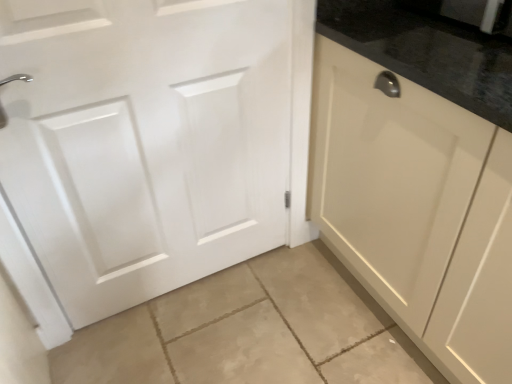
Locate an element on the screen. The height and width of the screenshot is (384, 512). matte cream cabinet at right is located at coordinates (416, 210).

This screenshot has width=512, height=384. Describe the element at coordinates (416, 210) in the screenshot. I see `matte cream cabinet at right` at that location.

Measure the distance between point [487,261] and camera.

Point [487,261] is 92.30 centimeters away from camera.

This screenshot has width=512, height=384. What are the coordinates of `white matte door at left` in the screenshot? It's located at (153, 139).

What do you see at coordinates (153, 139) in the screenshot? I see `white matte door at left` at bounding box center [153, 139].

The width and height of the screenshot is (512, 384). I want to click on matte cream cabinet at right, so click(x=416, y=210).

Which is more to the right, matte cream cabinet at right or white matte door at left?

matte cream cabinet at right is more to the right.

Does matte cream cabinet at right lie in front of white matte door at left?

Yes, it is in front of white matte door at left.

Is point (337, 172) positioned behind point (96, 229)?

Yes, it is behind point (96, 229).

From the image's perspective, is matte cream cabinet at right over white matte door at left?

No, from the image's perspective, matte cream cabinet at right is not on top of white matte door at left.

From a real-world perspective, is matte cream cabinet at right positioned over white matte door at left based on gravity?

Actually, matte cream cabinet at right is physically below white matte door at left in the real world.

Which of these two, matte cream cabinet at right or white matte door at left, is wider?

matte cream cabinet at right is wider.

In terms of height, does matte cream cabinet at right look taller or shorter compared to white matte door at left?

matte cream cabinet at right is shorter than white matte door at left.

Does matte cream cabinet at right have a smaller size compared to white matte door at left?

No, matte cream cabinet at right is not smaller than white matte door at left.

Is matte cream cabinet at right located outside white matte door at left?

Yes, matte cream cabinet at right is not within white matte door at left.

Is matte cream cabinet at right with white matte door at left?

No, matte cream cabinet at right is not making contact with white matte door at left.

Consider the image. Does matte cream cabinet at right turn towards white matte door at left?

Yes.

Can you tell me how much matte cream cabinet at right and white matte door at left differ in facing direction?

90.6 degrees.

You are a GUI agent. You are given a task and a screenshot of the screen. Output one action in this format:
    pyautogui.click(x=<x>, y=<y>)
    Task: Click on the door lying behind the matte cream cabinet at right
    
    Given the screenshot: What is the action you would take?
    pyautogui.click(x=153, y=139)

Based on their positions, is white matte door at left located to the left or right of matte cream cabinet at right?

Based on their positions, white matte door at left is located to the left of matte cream cabinet at right.

Is the position of white matte door at left less distant than that of matte cream cabinet at right?

No, the depth of white matte door at left is greater than that of matte cream cabinet at right.

Which is in front, point (203, 124) or point (406, 263)?

The point (406, 263) is closer to the camera.

From the image's perspective, does white matte door at left appear higher than matte cream cabinet at right?

Yes.

From a real-world perspective, is white matte door at left beneath matte cream cabinet at right?

Actually, white matte door at left is physically above matte cream cabinet at right in the real world.

Which of these two, white matte door at left or matte cream cabinet at right, is thinner?

white matte door at left.

Considering the relative sizes of white matte door at left and matte cream cabinet at right in the image provided, is white matte door at left shorter than matte cream cabinet at right?

No, white matte door at left is not shorter than matte cream cabinet at right.

Between white matte door at left and matte cream cabinet at right, which one has larger size?

matte cream cabinet at right.

Would you say matte cream cabinet at right is part of white matte door at left's contents?

No, matte cream cabinet at right is not inside white matte door at left.

Are white matte door at left and matte cream cabinet at right located far from each other?

white matte door at left is near matte cream cabinet at right, not far away.

Could you tell me if white matte door at left is turned towards matte cream cabinet at right?

No.

What's the angular difference between white matte door at left and matte cream cabinet at right's facing directions?

white matte door at left and matte cream cabinet at right are facing 90.6 degrees away from each other.

This screenshot has width=512, height=384. I want to click on door that is behind the matte cream cabinet at right, so click(153, 139).

What are the coordinates of `cabinetry located below the white matte door at left (from the image's perspective)` in the screenshot? It's located at (416, 210).

Identify the location of door behind the matte cream cabinet at right. Image resolution: width=512 pixels, height=384 pixels. (153, 139).